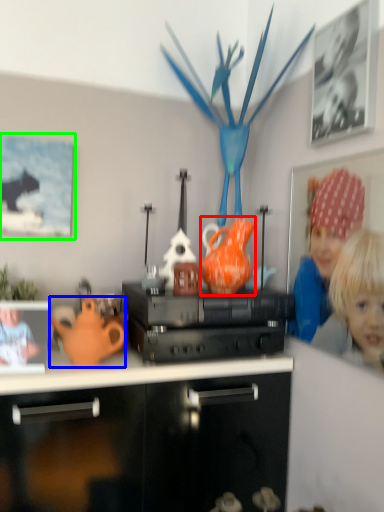
Question: Which is nearer to the tea pot (highlighted by a red box)? teapot (highlighted by a blue box) or picture frame (highlighted by a green box).

Choices:
 (A) teapot
 (B) picture frame

Answer: (A)